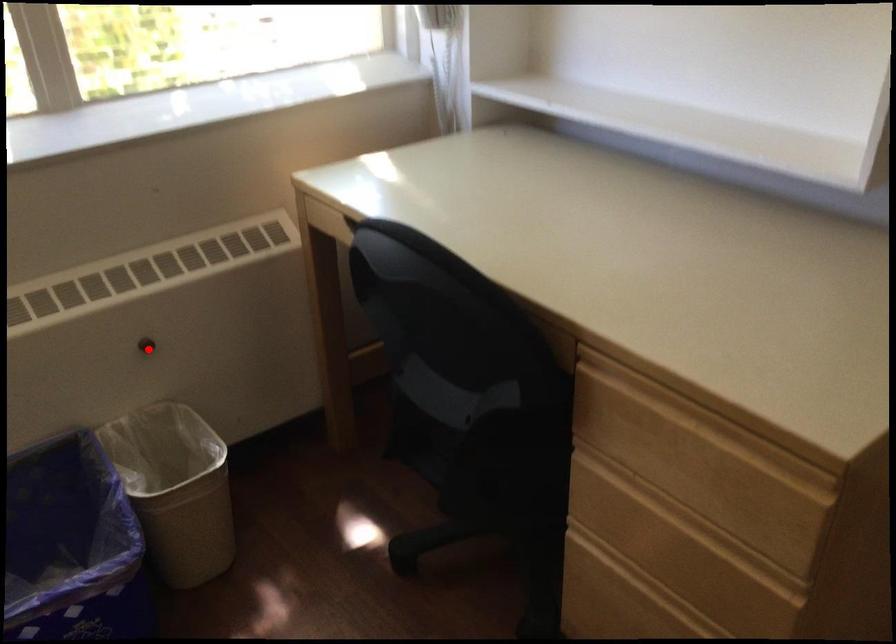
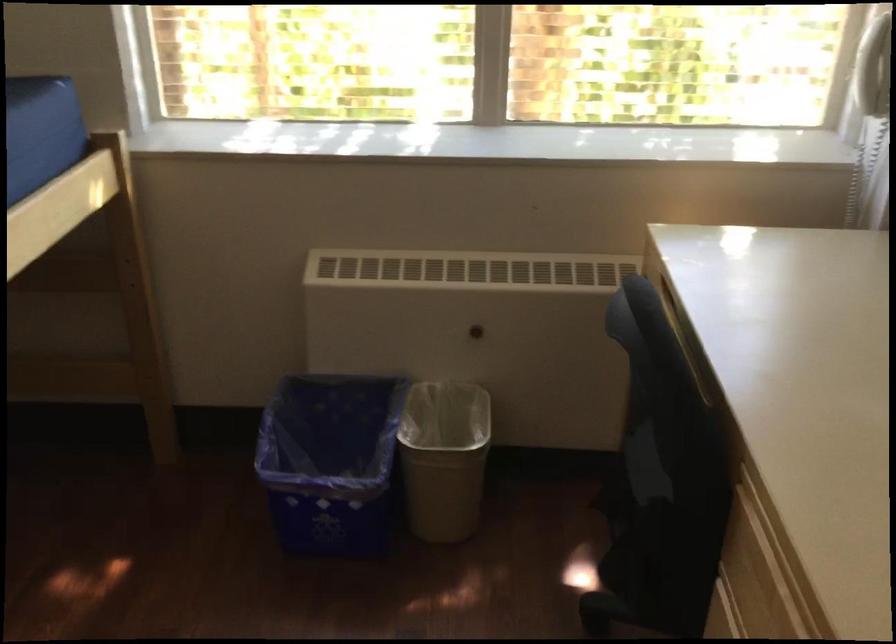
Question: I am providing you with two images of the same scene from different viewpoints. In image1, a red point is highlighted. Considering the same 3D point in image2, which of the following is correct?

Choices:
 (A) It is closer
 (B) It is farther

Answer: (B)